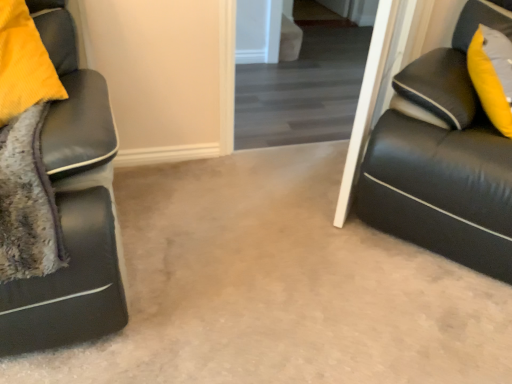
Question: Is matte black couch at right inside or outside of transparent glass door at upper center?

Choices:
 (A) outside
 (B) inside

Answer: (A)

Question: Looking at the image, does matte black couch at right seem bigger or smaller compared to transparent glass door at upper center?

Choices:
 (A) big
 (B) small

Answer: (A)

Question: Is matte black couch at right taller or shorter than transparent glass door at upper center?

Choices:
 (A) short
 (B) tall

Answer: (B)

Question: Looking at their shapes, would you say transparent glass door at upper center is wider or thinner than matte black couch at right?

Choices:
 (A) wide
 (B) thin

Answer: (B)

Question: Is point (246, 74) closer or farther from the camera than point (406, 97)?

Choices:
 (A) farther
 (B) closer

Answer: (A)

Question: Based on their sizes in the image, would you say transparent glass door at upper center is bigger or smaller than matte black couch at right?

Choices:
 (A) big
 (B) small

Answer: (B)

Question: From the image's perspective, is transparent glass door at upper center above or below matte black couch at right?

Choices:
 (A) above
 (B) below

Answer: (A)